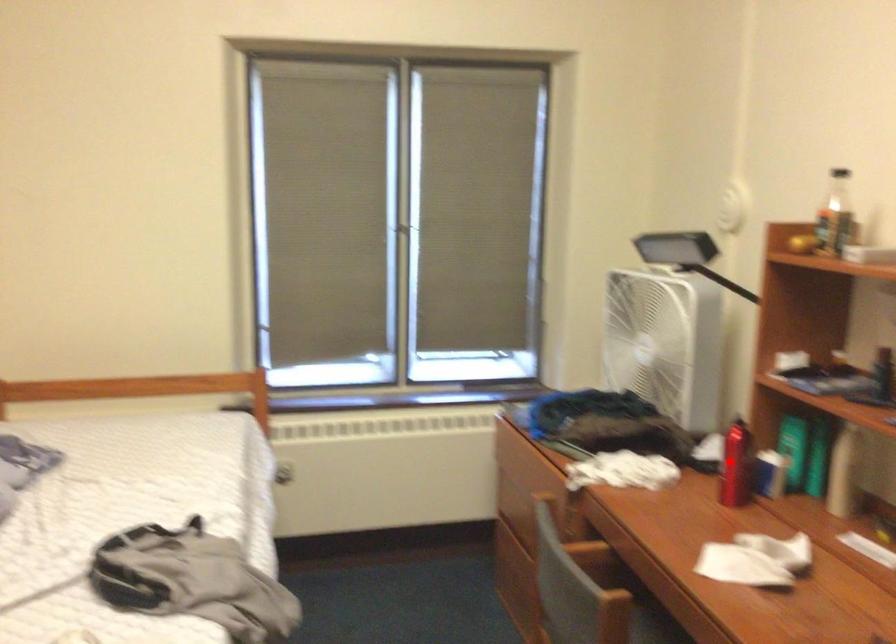
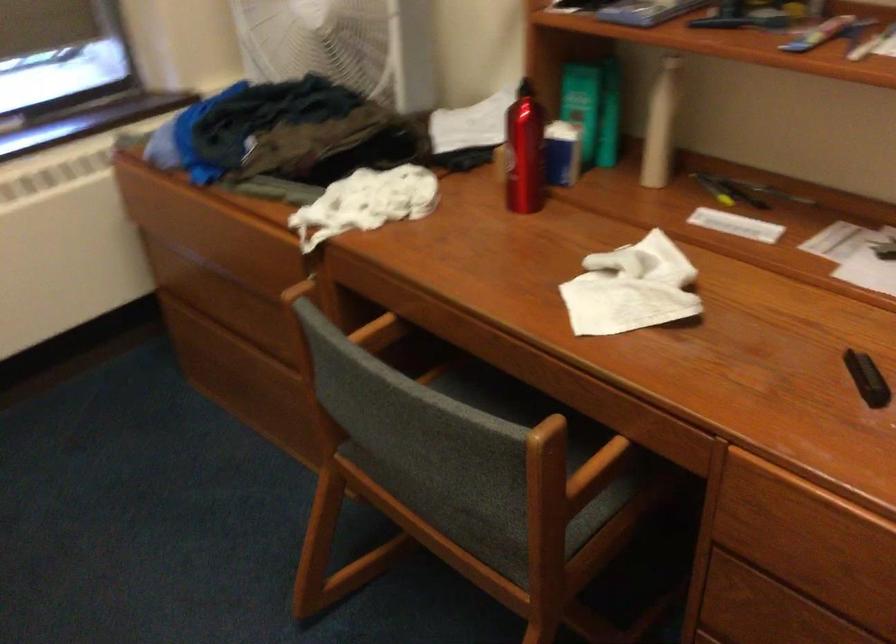
Where in the second image is the point corresponding to the highlighted location from the first image?

(524, 152)